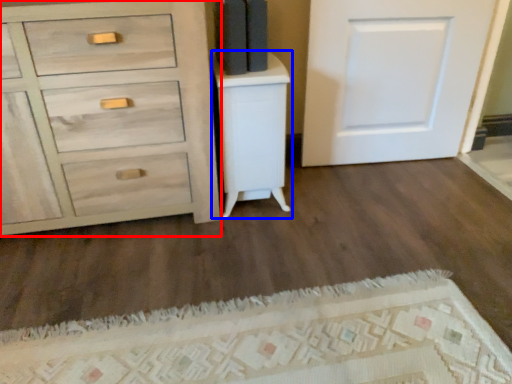
Question: Which of the following is the closest to the observer, chest of drawers (highlighted by a red box) or vanity (highlighted by a blue box)?

Choices:
 (A) chest of drawers
 (B) vanity

Answer: (A)